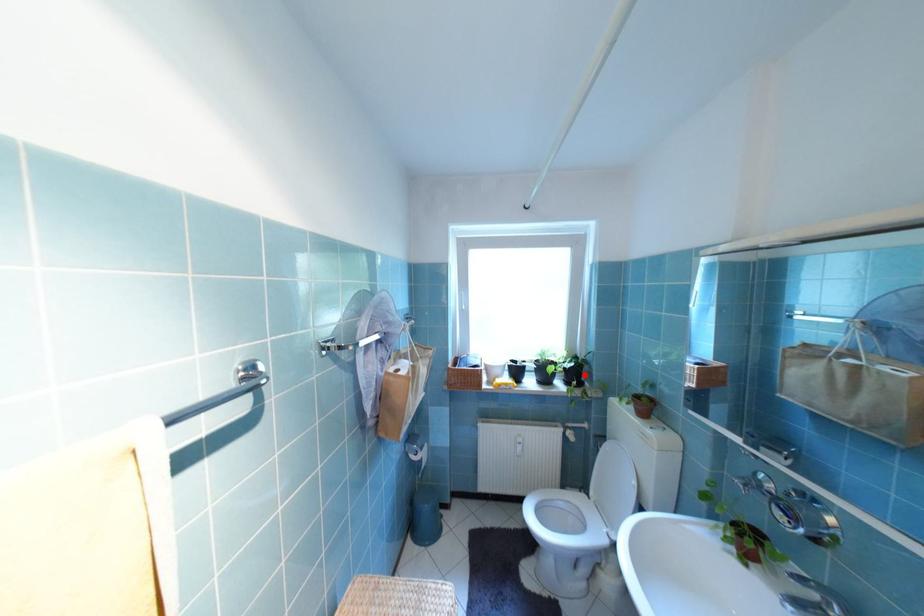
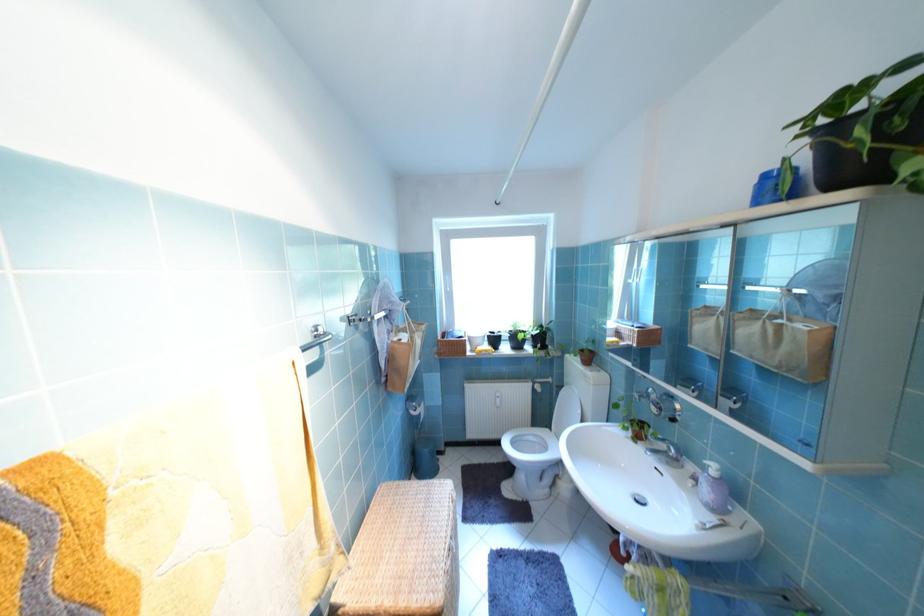
Find the pixel in the second image that matches the highlighted location in the first image.

(550, 339)